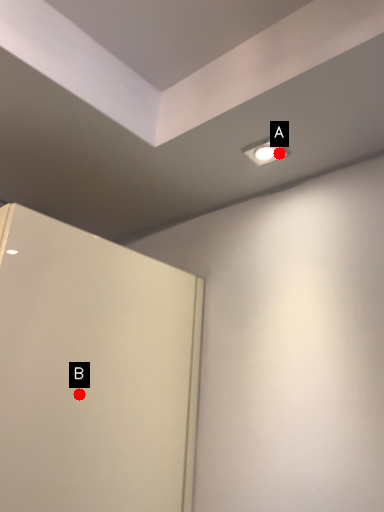
Question: Two points are circled on the image, labeled by A and B beside each circle. Which of the following is the farthest from the observer?

Choices:
 (A) A is further
 (B) B is further

Answer: (A)